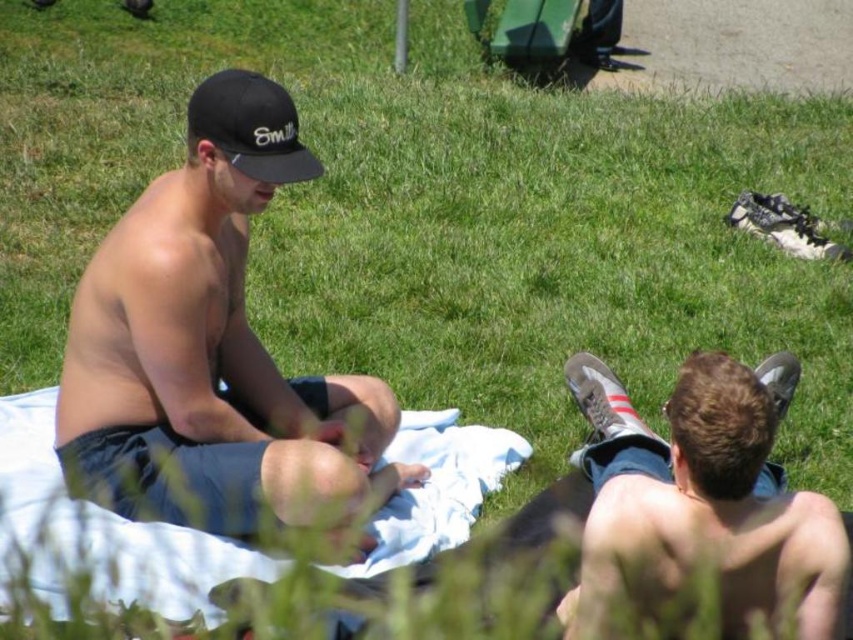
You are planning to place a small picnic basket between the matte gray sneakers at lower right and the black matte baseball cap at upper left. Given that the basket is 2 feet wide, will it fit without overlapping either object?

The distance between the matte gray sneakers at lower right and the black matte baseball cap at upper left is 3.62 feet. Since the basket is 2 feet wide, there is enough space to place it between them without overlapping either object.

You are planning to place a small picnic basket on the grass between the white cloth at center and the black matte baseball cap at upper left. Based on their positions, which object should the basket be closer to?

The white cloth at center is positioned on the left side of the black matte baseball cap at upper left, so the picnic basket should be placed closer to the white cloth at center to maintain the left alignment.